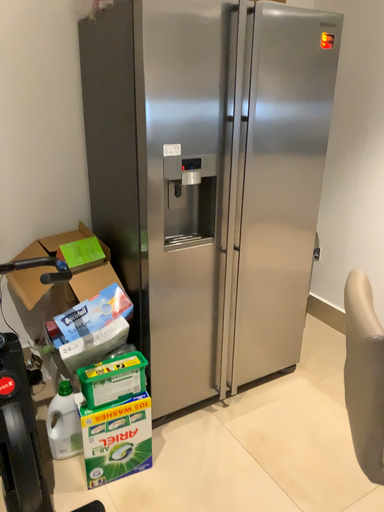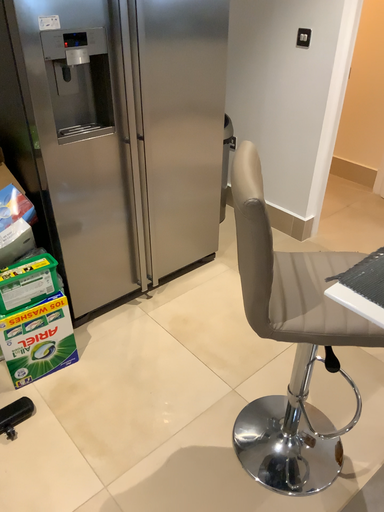
Question: Which way did the camera rotate in the video?

Choices:
 (A) rotated left
 (B) rotated right

Answer: (B)